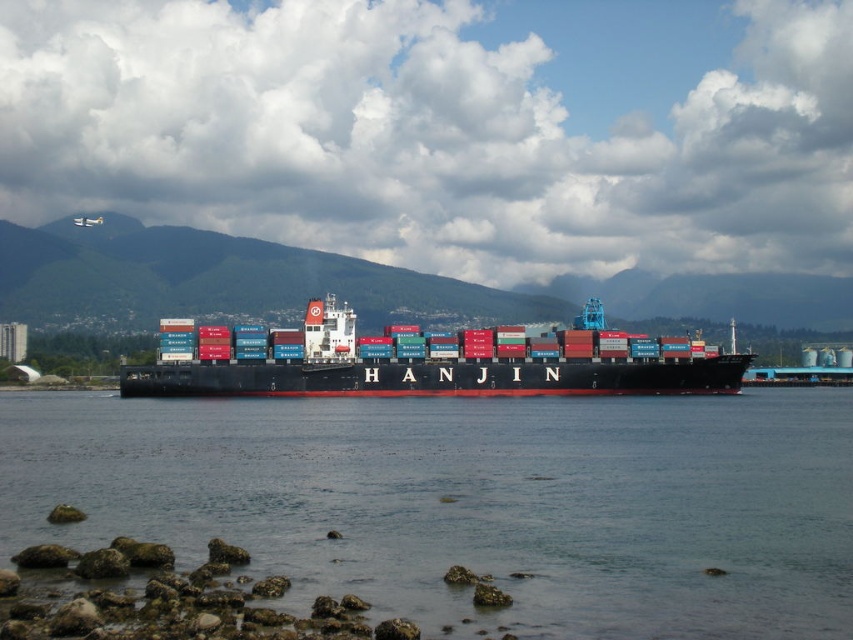
Question: Among these points, which one is farthest from the camera?

Choices:
 (A) (256, 371)
 (B) (248, 440)

Answer: (A)

Question: Does clear water at center have a smaller size compared to red matte container ship at center?

Choices:
 (A) no
 (B) yes

Answer: (B)

Question: From the image, what is the correct spatial relationship of clear water at center in relation to red matte container ship at center?

Choices:
 (A) right
 (B) left

Answer: (A)

Question: Which of the following is the farthest from the observer?

Choices:
 (A) (686, 420)
 (B) (582, 371)

Answer: (B)

Question: Which object is farther from the camera taking this photo?

Choices:
 (A) red matte container ship at center
 (B) clear water at center

Answer: (A)

Question: Is clear water at center above red matte container ship at center?

Choices:
 (A) yes
 (B) no

Answer: (B)